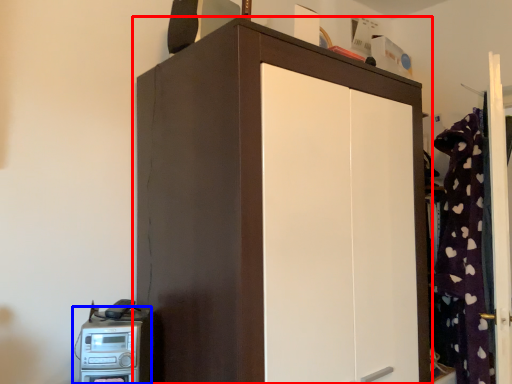
Question: Which point is closer to the camera, cupboard (highlighted by a red box) or home appliance (highlighted by a blue box)?

Choices:
 (A) cupboard
 (B) home appliance

Answer: (A)